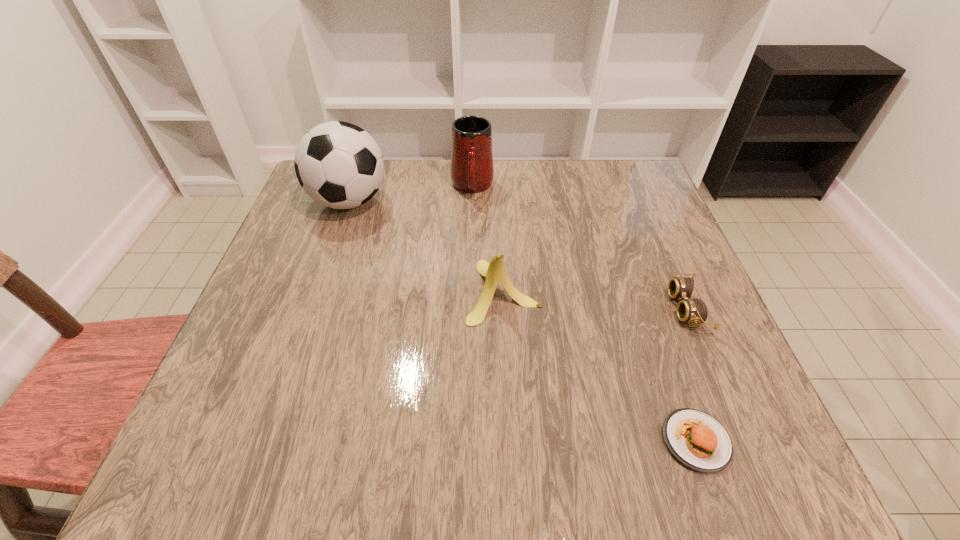
At what (x,y) coordinates should I click in order to perform the action: click on blank space located 0.100m through the lenses of the goggles. Please return your answer as a coordinate pair (x, y). The image size is (960, 540). Looking at the image, I should click on (621, 308).

The width and height of the screenshot is (960, 540). I want to click on vacant space located through the lenses of the goggles, so click(521, 308).

I want to click on vacant area situated 0.370m through the lenses of the goggles, so click(x=486, y=308).

Find the location of a particular element. This screenshot has width=960, height=540. blank area located 0.390m on the left of the nearest object is located at coordinates (415, 441).

Locate an element on the screen. soccer ball present at the far edge is located at coordinates (338, 164).

Where is `mug at the far edge`? The image size is (960, 540). mug at the far edge is located at coordinates (472, 170).

The image size is (960, 540). Identify the location of object located in the near edge section of the desktop. (696, 439).

This screenshot has width=960, height=540. Find the location of `object located at the left edge`. object located at the left edge is located at coordinates (338, 164).

Identify the location of goggles that is at the right edge. (692, 311).

Find the location of `food at the right edge`. food at the right edge is located at coordinates (696, 439).